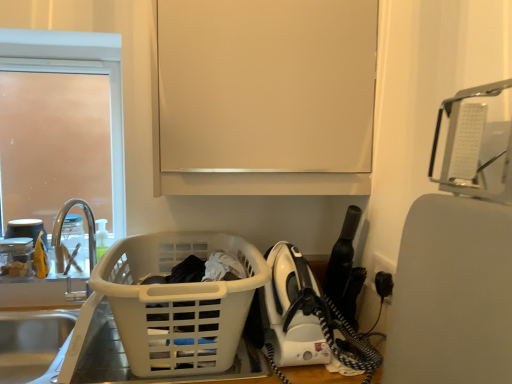
Question: From a real-world perspective, is translucent plastic bottle at sink left physically below white plastic laundry basket at lower left?

Choices:
 (A) yes
 (B) no

Answer: (B)

Question: Considering the relative sizes of translucent plastic bottle at sink left and white plastic laundry basket at lower left in the image provided, is translucent plastic bottle at sink left bigger than white plastic laundry basket at lower left?

Choices:
 (A) no
 (B) yes

Answer: (A)

Question: From the image's perspective, is translucent plastic bottle at sink left under white plastic laundry basket at lower left?

Choices:
 (A) no
 (B) yes

Answer: (A)

Question: Is translucent plastic bottle at sink left shorter than white plastic laundry basket at lower left?

Choices:
 (A) no
 (B) yes

Answer: (B)

Question: Does translucent plastic bottle at sink left appear on the left side of white plastic laundry basket at lower left?

Choices:
 (A) no
 (B) yes

Answer: (B)

Question: From a real-world perspective, is frosted glass door at upper left positioned above or below white plastic iron at lower right?

Choices:
 (A) below
 (B) above

Answer: (B)

Question: From their relative heights in the image, would you say frosted glass door at upper left is taller or shorter than white plastic iron at lower right?

Choices:
 (A) tall
 (B) short

Answer: (A)

Question: In the image, is frosted glass door at upper left positioned in front of or behind white plastic iron at lower right?

Choices:
 (A) behind
 (B) front

Answer: (A)

Question: From the image's perspective, is frosted glass door at upper left positioned above or below white plastic iron at lower right?

Choices:
 (A) below
 (B) above

Answer: (B)

Question: Is clear glass faucet at left inside the boundaries of brushed metal sink at left, the 1th sink when ordered from top to bottom, or outside?

Choices:
 (A) inside
 (B) outside

Answer: (B)

Question: Considering the positions of clear glass faucet at left and brushed metal sink at left, which is the second sink in bottom-to-top order, in the image, is clear glass faucet at left taller or shorter than brushed metal sink at left, which is the second sink in bottom-to-top order,?

Choices:
 (A) tall
 (B) short

Answer: (B)

Question: Is point (86, 218) closer or farther from the camera than point (44, 321)?

Choices:
 (A) farther
 (B) closer

Answer: (A)

Question: Based on their positions, is clear glass faucet at left located to the left or right of brushed metal sink at left, the 1th sink when ordered from top to bottom?

Choices:
 (A) left
 (B) right

Answer: (A)

Question: Visually, is frosted glass door at upper left positioned to the left or to the right of clear glass faucet at left?

Choices:
 (A) right
 (B) left

Answer: (B)

Question: From the image's perspective, is frosted glass door at upper left located above or below clear glass faucet at left?

Choices:
 (A) below
 (B) above

Answer: (B)